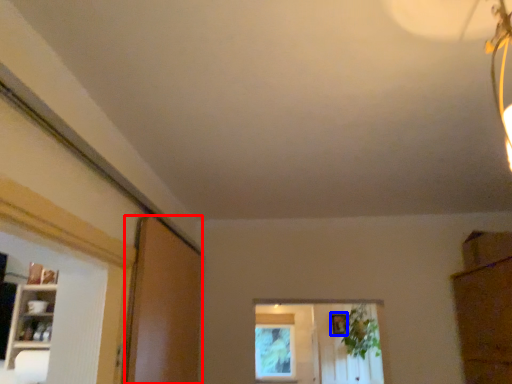
Question: Which object is further to the camera taking this photo, screen door (highlighted by a red box) or picture frame (highlighted by a blue box)?

Choices:
 (A) screen door
 (B) picture frame

Answer: (B)